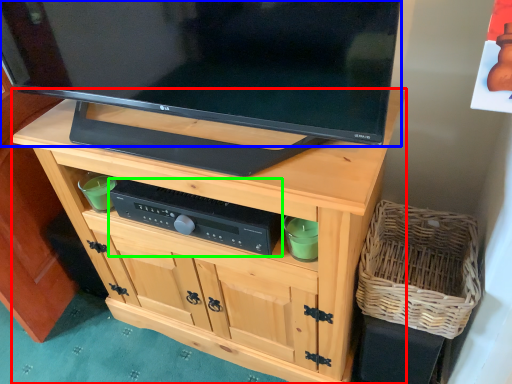
Question: Based on their relative distances, which object is farther from cabinetry (highlighted by a red box)? Choose from television (highlighted by a blue box) and control (highlighted by a green box).

Choices:
 (A) television
 (B) control

Answer: (A)